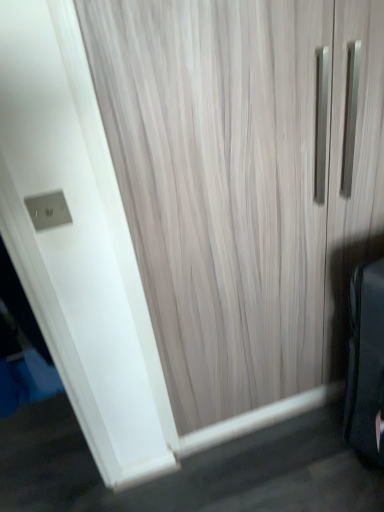
Question: Does point (33, 204) appear closer or farther from the camera than point (337, 8)?

Choices:
 (A) farther
 (B) closer

Answer: (A)

Question: From their relative heights in the image, would you say satin silver outlet at upper left is taller or shorter than wooden door at center?

Choices:
 (A) tall
 (B) short

Answer: (B)

Question: From a real-world perspective, is satin silver outlet at upper left physically located above or below wooden door at center?

Choices:
 (A) below
 (B) above

Answer: (B)

Question: Relative to satin silver outlet at upper left, is wooden door at center in front or behind?

Choices:
 (A) behind
 (B) front

Answer: (B)

Question: From a real-world perspective, is wooden door at center physically located above or below satin silver outlet at upper left?

Choices:
 (A) below
 (B) above

Answer: (A)

Question: Is point click(306, 307) closer or farther from the camera than point click(66, 211)?

Choices:
 (A) farther
 (B) closer

Answer: (A)

Question: From the image's perspective, relative to satin silver outlet at upper left, is wooden door at center above or below?

Choices:
 (A) above
 (B) below

Answer: (B)